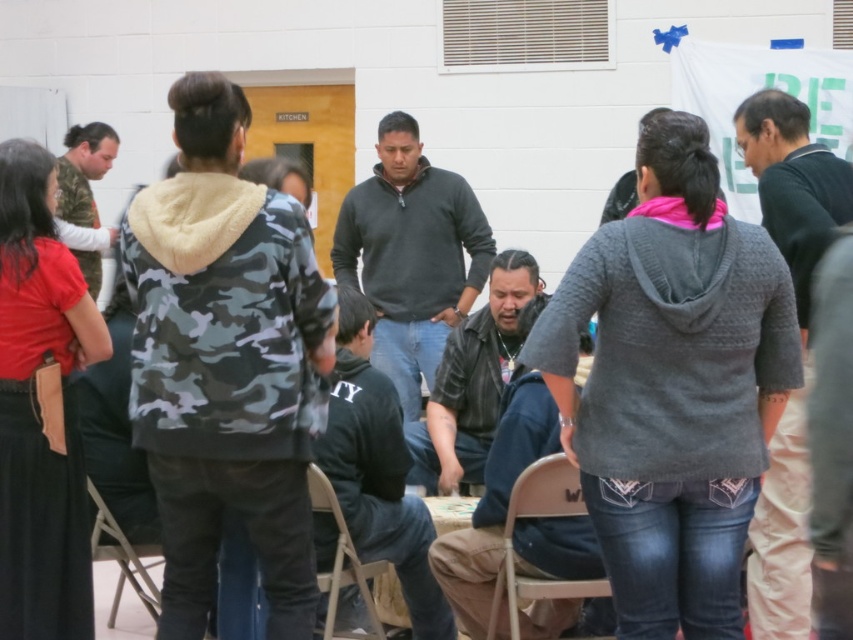
Does point (469, 440) come behind point (83, 256)?

No, (469, 440) is closer to viewer.

Is leather jacket at center taller than camouflage jacket at left?

Incorrect, leather jacket at center's height is not larger of camouflage jacket at left's.

Who is more forward, [496,268] or [64,198]?

Point [496,268]

The image size is (853, 640). I want to click on leather jacket at center, so click(473, 381).

Who is lower down, camo-patterned hoodie at center or black leather jacket at center?

Positioned lower is black leather jacket at center.

Is camo-patterned hoodie at center to the left of black leather jacket at center from the viewer's perspective?

Yes, camo-patterned hoodie at center is to the left of black leather jacket at center.

Where is `camo-patterned hoodie at center`? The width and height of the screenshot is (853, 640). camo-patterned hoodie at center is located at coordinates (225, 362).

Who is shorter, red cotton shirt at left or wooden folding chair at lower center?

wooden folding chair at lower center is shorter.

Based on the photo, who is taller, red cotton shirt at left or wooden folding chair at lower center?

Standing taller between the two is red cotton shirt at left.

Image resolution: width=853 pixels, height=640 pixels. I want to click on red cotton shirt at left, so click(x=41, y=408).